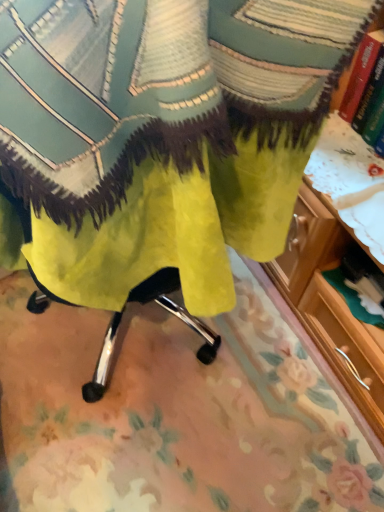
Find the location of a particular element. Image resolution: width=384 pixels, height=512 pixels. velvet yellow blanket at center is located at coordinates (163, 134).

The image size is (384, 512). Describe the element at coordinates (163, 134) in the screenshot. I see `velvet yellow blanket at center` at that location.

The image size is (384, 512). What are the coordinates of `velvet yellow blanket at center` in the screenshot? It's located at (163, 134).